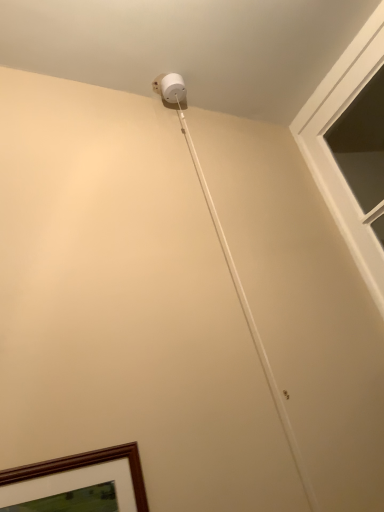
Question: From the image's perspective, is white matte string at upper center located above or below clear glass window at upper right?

Choices:
 (A) above
 (B) below

Answer: (B)

Question: Does point (266, 360) appear closer or farther from the camera than point (362, 263)?

Choices:
 (A) farther
 (B) closer

Answer: (B)

Question: Looking at the image, does white matte string at upper center seem bigger or smaller compared to clear glass window at upper right?

Choices:
 (A) small
 (B) big

Answer: (A)

Question: Considering the positions of clear glass window at upper right and white matte string at upper center in the image, is clear glass window at upper right wider or thinner than white matte string at upper center?

Choices:
 (A) thin
 (B) wide

Answer: (B)

Question: From the image's perspective, relative to white matte string at upper center, is clear glass window at upper right above or below?

Choices:
 (A) below
 (B) above

Answer: (B)

Question: Considering the positions of clear glass window at upper right and white matte string at upper center in the image, is clear glass window at upper right bigger or smaller than white matte string at upper center?

Choices:
 (A) small
 (B) big

Answer: (B)

Question: From their relative heights in the image, would you say clear glass window at upper right is taller or shorter than white matte string at upper center?

Choices:
 (A) tall
 (B) short

Answer: (B)